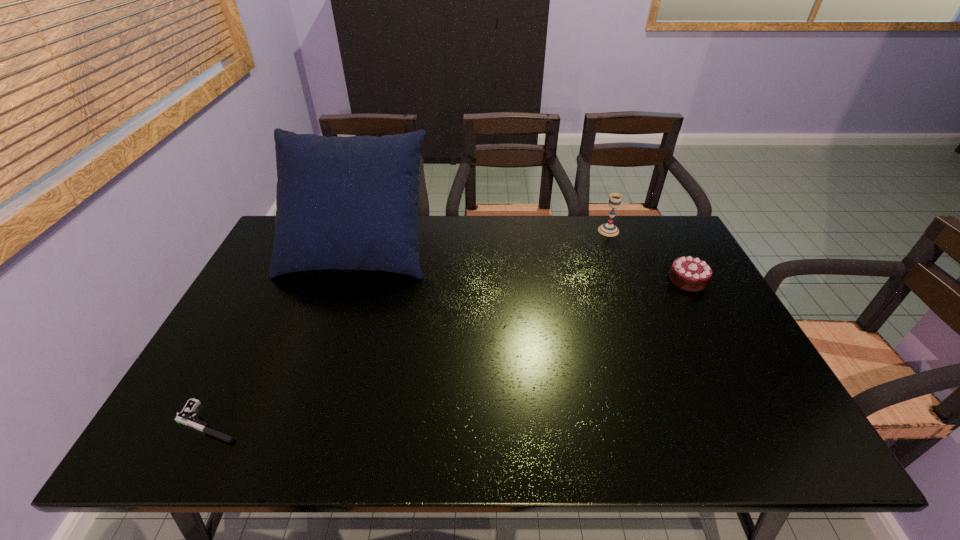
Where is `vacant point located between the third object from left to right and the chocolate cake`? The width and height of the screenshot is (960, 540). vacant point located between the third object from left to right and the chocolate cake is located at coordinates (648, 255).

At what (x,y) coordinates should I click in order to perform the action: click on vacant area that lies between the cushion and the second tallest object. Please return your answer as a coordinate pair (x, y). This screenshot has width=960, height=540. Looking at the image, I should click on (483, 239).

Where is `object that ranks as the closest to the second shortest object`? This screenshot has width=960, height=540. object that ranks as the closest to the second shortest object is located at coordinates (608, 229).

Select which object is the third closest to the rightmost object. Please provide its 2D coordinates. Your answer should be formatted as a tuple, i.e. [(x, y)], where the tuple contains the x and y coordinates of a point satisfying the conditions above.

[(186, 416)]

The height and width of the screenshot is (540, 960). What are the coordinates of `vacant space that satisfies the following two spatial constraints: 1. on the front side of the second shortest object; 2. on the front-facing side of the nearest object` in the screenshot? It's located at (763, 422).

The height and width of the screenshot is (540, 960). What are the coordinates of `vacant position in the image that satisfies the following two spatial constraints: 1. on the facing side of the chocolate cake; 2. on the right side of the cushion` in the screenshot? It's located at (347, 280).

Where is `vacant space that satisfies the following two spatial constraints: 1. on the facing side of the third tallest object; 2. on the left side of the tallest object`? This screenshot has width=960, height=540. vacant space that satisfies the following two spatial constraints: 1. on the facing side of the third tallest object; 2. on the left side of the tallest object is located at coordinates (347, 280).

Identify the location of vacant space that satisfies the following two spatial constraints: 1. on the facing side of the cushion; 2. on the right side of the rightmost object. The width and height of the screenshot is (960, 540). (347, 280).

Locate an element on the screen. This screenshot has width=960, height=540. vacant space that satisfies the following two spatial constraints: 1. on the front side of the third object from left to right; 2. on the front-facing side of the pistol is located at coordinates (682, 422).

I want to click on vacant space that satisfies the following two spatial constraints: 1. on the front side of the chalice; 2. on the right side of the rightmost object, so click(627, 280).